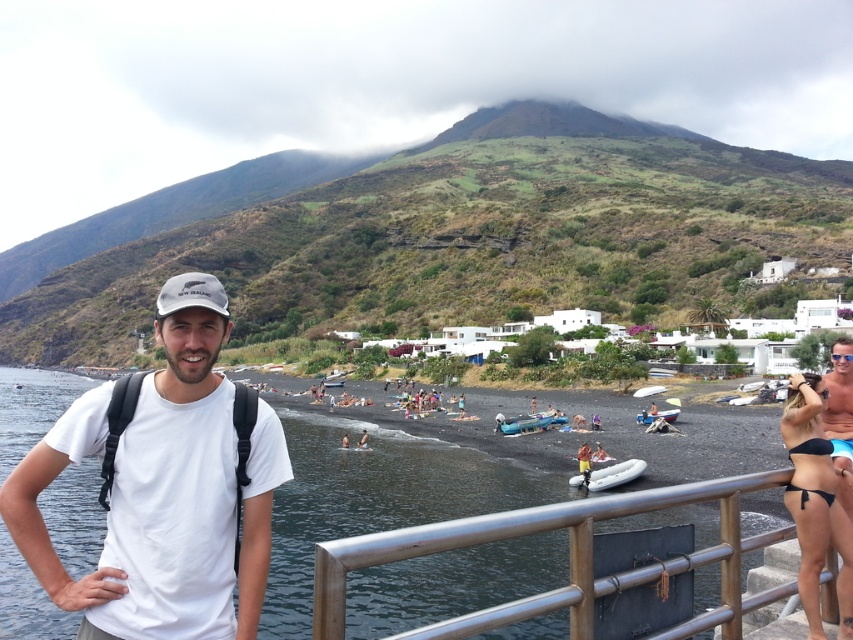
Question: Can you confirm if white cotton t-shirt at left is positioned to the left of black bikini at lower right?

Choices:
 (A) yes
 (B) no

Answer: (A)

Question: Can you confirm if inflatable blue boat at center is wider than white plastic boat at center?

Choices:
 (A) yes
 (B) no

Answer: (A)

Question: Considering the real-world distances, which object is closest to the white rubber boat at center?

Choices:
 (A) white plastic boat at center
 (B) silver metallic railing at lower right
 (C) inflatable yellow at center

Answer: (A)

Question: Does white cotton t-shirt at left appear under silver metallic railing at lower right?

Choices:
 (A) no
 (B) yes

Answer: (A)

Question: Which point appears closest to the camera in this image?

Choices:
 (A) (637, 390)
 (B) (814, 454)

Answer: (B)

Question: Among these points, which one is farthest from the camera?

Choices:
 (A) (643, 387)
 (B) (618, 472)

Answer: (A)